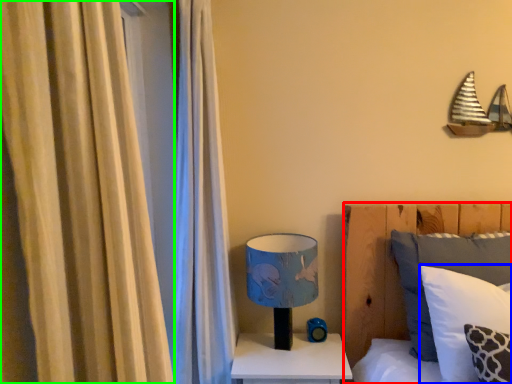
Question: Which object is the closest to the bed (highlighted by a red box)? Choose among these: pillow (highlighted by a blue box) or curtain (highlighted by a green box).

Choices:
 (A) pillow
 (B) curtain

Answer: (A)